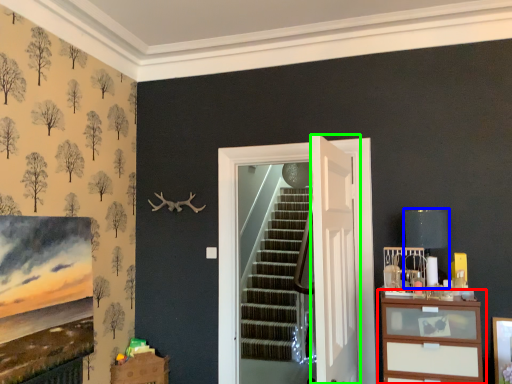
Question: Considering the real-world distances, which object is closest to chest of drawers (highlighted by a red box)? lamp (highlighted by a blue box) or door (highlighted by a green box).

Choices:
 (A) lamp
 (B) door

Answer: (B)